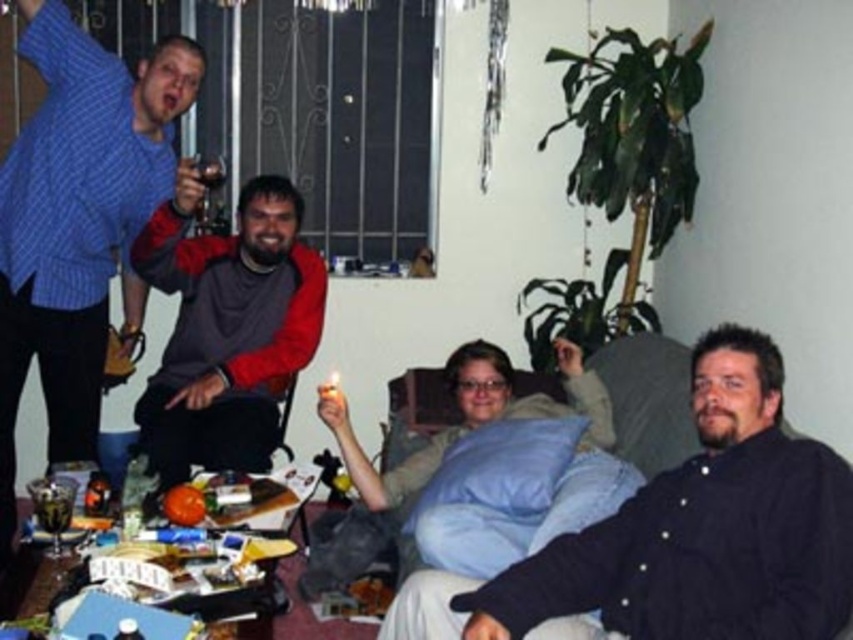
Question: Is the position of blue plaid shirt at upper left less distant than that of dark gray fleece jacket at center?

Choices:
 (A) yes
 (B) no

Answer: (A)

Question: Can you confirm if black cotton shirt at lower right is positioned to the left of metallic silver can at upper left?

Choices:
 (A) no
 (B) yes

Answer: (A)

Question: Which point is closer to the camera taking this photo?

Choices:
 (A) (257, 196)
 (B) (213, 173)

Answer: (B)

Question: From the image, what is the correct spatial relationship of black cotton shirt at lower right in relation to dark gray fleece jacket at center?

Choices:
 (A) right
 (B) left

Answer: (A)

Question: Which object appears closest to the camera in this image?

Choices:
 (A) dark gray fleece jacket at center
 (B) black cotton shirt at lower right

Answer: (B)

Question: Which object is farther from the camera taking this photo?

Choices:
 (A) dark gray fleece jacket at center
 (B) black cotton shirt at lower right
 (C) metallic silver can at upper left
 (D) blue plaid shirt at upper left

Answer: (C)